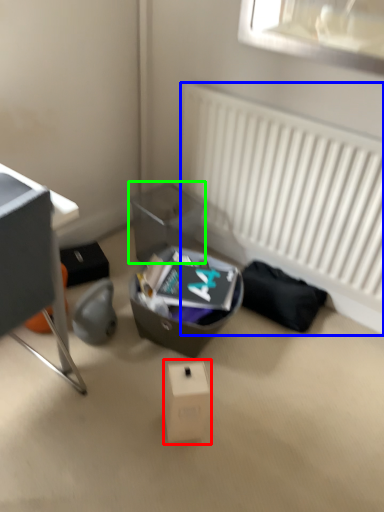
Question: Which object is the closest to the cardboard box (highlighted by a red box)? Choose among these: radiator (highlighted by a blue box) or shoe box (highlighted by a green box).

Choices:
 (A) radiator
 (B) shoe box

Answer: (B)